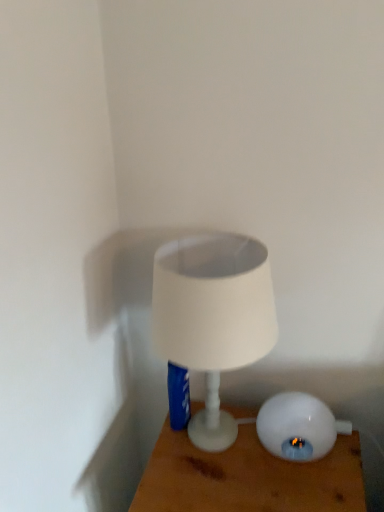
Find the location of `white matte lampshade at center, acting as the first lamp starting from the left`. white matte lampshade at center, acting as the first lamp starting from the left is located at coordinates (213, 317).

The height and width of the screenshot is (512, 384). What do you see at coordinates (248, 477) in the screenshot? I see `white glossy lamp at center` at bounding box center [248, 477].

Identify the location of white glossy lamp at lower right, the first lamp in the right-to-left sequence. (298, 426).

Between white glossy lamp at lower right, the second lamp from the left, and white matte lampshade at center, acting as the first lamp starting from the left, which one has more height?

Standing taller between the two is white matte lampshade at center, acting as the first lamp starting from the left.

Is point (276, 395) in front of point (154, 264)?

That is False.

Considering the relative sizes of white glossy lamp at lower right, the first lamp in the right-to-left sequence, and white matte lampshade at center, the 2th lamp when ordered from right to left, in the image provided, is white glossy lamp at lower right, the first lamp in the right-to-left sequence, thinner than white matte lampshade at center, the 2th lamp when ordered from right to left,?

Correct, the width of white glossy lamp at lower right, the first lamp in the right-to-left sequence, is less than that of white matte lampshade at center, the 2th lamp when ordered from right to left.

Consider the image. Is white glossy lamp at lower right, the second lamp from the left, directly adjacent to white matte lampshade at center, acting as the first lamp starting from the left?

No, white glossy lamp at lower right, the second lamp from the left, is not with white matte lampshade at center, acting as the first lamp starting from the left.

From the image's perspective, is white matte lampshade at center, the 2th lamp when ordered from right to left, positioned above or below white glossy lamp at center?

From the image's perspective, white matte lampshade at center, the 2th lamp when ordered from right to left, appears above white glossy lamp at center.

Considering the relative positions of white matte lampshade at center, the 2th lamp when ordered from right to left, and white glossy lamp at center in the image provided, is white matte lampshade at center, the 2th lamp when ordered from right to left, behind white glossy lamp at center?

No, it is in front of white glossy lamp at center.

Between white matte lampshade at center, the 2th lamp when ordered from right to left, and white glossy lamp at center, which one has smaller width?

white matte lampshade at center, the 2th lamp when ordered from right to left, is thinner.

Which of these two, white matte lampshade at center, the 2th lamp when ordered from right to left, or white glossy lamp at center, is smaller?

With smaller size is white matte lampshade at center, the 2th lamp when ordered from right to left.

This screenshot has height=512, width=384. Identify the location of lamp that is on the right side of white glossy lamp at center. (298, 426).

Is white glossy lamp at lower right, the first lamp in the right-to-left sequence, with white glossy lamp at center?

No.

Could you measure the distance between white glossy lamp at lower right, the second lamp from the left, and white glossy lamp at center?

white glossy lamp at lower right, the second lamp from the left, and white glossy lamp at center are 11.30 centimeters apart.

How different are the orientations of white matte lampshade at center, the 2th lamp when ordered from right to left, and white glossy lamp at lower right, the first lamp in the right-to-left sequence, in degrees?

white matte lampshade at center, the 2th lamp when ordered from right to left, and white glossy lamp at lower right, the first lamp in the right-to-left sequence, are facing 1.5 degrees away from each other.

Which of these two, white matte lampshade at center, the 2th lamp when ordered from right to left, or white glossy lamp at lower right, the first lamp in the right-to-left sequence, stands shorter?

Standing shorter between the two is white glossy lamp at lower right, the first lamp in the right-to-left sequence.

Is white matte lampshade at center, acting as the first lamp starting from the left, oriented towards white glossy lamp at lower right, the second lamp from the left?

No, white matte lampshade at center, acting as the first lamp starting from the left, does not turn towards white glossy lamp at lower right, the second lamp from the left.

Locate an element on the screen. The image size is (384, 512). lamp above the white glossy lamp at lower right, the first lamp in the right-to-left sequence (from the image's perspective) is located at coordinates (213, 317).

Is white glossy lamp at center positioned far away from white glossy lamp at lower right, the first lamp in the right-to-left sequence?

They are positioned close to each other.

From a real-world perspective, is white glossy lamp at center physically below white glossy lamp at lower right, the second lamp from the left?

Yes, from a real-world perspective, white glossy lamp at center is under white glossy lamp at lower right, the second lamp from the left.

Where is `furniture that is on the left side of white glossy lamp at lower right, the second lamp from the left`? The width and height of the screenshot is (384, 512). furniture that is on the left side of white glossy lamp at lower right, the second lamp from the left is located at coordinates (248, 477).

How different are the orientations of white glossy lamp at center and white glossy lamp at lower right, the second lamp from the left, in degrees?

There is a 1.65-degree angle between the facing directions of white glossy lamp at center and white glossy lamp at lower right, the second lamp from the left.

Does white glossy lamp at center turn towards white matte lampshade at center, the 2th lamp when ordered from right to left?

No, white glossy lamp at center does not turn towards white matte lampshade at center, the 2th lamp when ordered from right to left.

Based on their positions, is white glossy lamp at center located to the left or right of white matte lampshade at center, acting as the first lamp starting from the left?

white glossy lamp at center is positioned on white matte lampshade at center, acting as the first lamp starting from the left,'s right side.

From a real-world perspective, which object stands above the other?

In real-world perspective, white matte lampshade at center, acting as the first lamp starting from the left, is above.

This screenshot has height=512, width=384. Find the location of `lamp on the left of white glossy lamp at lower right, the first lamp in the right-to-left sequence`. lamp on the left of white glossy lamp at lower right, the first lamp in the right-to-left sequence is located at coordinates (213, 317).

Where is `lamp that is the 2nd object above the white glossy lamp at center (from a real-world perspective)`? Image resolution: width=384 pixels, height=512 pixels. lamp that is the 2nd object above the white glossy lamp at center (from a real-world perspective) is located at coordinates (213, 317).

Considering their positions, is white glossy lamp at center positioned further to white glossy lamp at lower right, the second lamp from the left, than white matte lampshade at center, acting as the first lamp starting from the left?

Based on the image, white matte lampshade at center, acting as the first lamp starting from the left, appears to be further to white glossy lamp at lower right, the second lamp from the left.

Estimate the real-world distances between objects in this image. Which object is closer to white glossy lamp at center, white glossy lamp at lower right, the second lamp from the left, or white matte lampshade at center, the 2th lamp when ordered from right to left?

white glossy lamp at lower right, the second lamp from the left, lies closer to white glossy lamp at center than the other object.

Consider the image. From the image, which object appears to be nearer to white glossy lamp at lower right, the second lamp from the left, white matte lampshade at center, the 2th lamp when ordered from right to left, or white glossy lamp at center?

Among the two, white glossy lamp at center is located nearer to white glossy lamp at lower right, the second lamp from the left.

From the image, which object appears to be farther from white matte lampshade at center, the 2th lamp when ordered from right to left, white glossy lamp at center or white glossy lamp at lower right, the second lamp from the left?

white glossy lamp at lower right, the second lamp from the left, is further to white matte lampshade at center, the 2th lamp when ordered from right to left.

Considering their positions, is white matte lampshade at center, acting as the first lamp starting from the left, positioned closer to white glossy lamp at center than white glossy lamp at lower right, the second lamp from the left?

white glossy lamp at lower right, the second lamp from the left, is positioned closer to the anchor white glossy lamp at center.

From the image, which object appears to be farther from white matte lampshade at center, acting as the first lamp starting from the left, white glossy lamp at lower right, the first lamp in the right-to-left sequence, or white glossy lamp at center?

Among the two, white glossy lamp at lower right, the first lamp in the right-to-left sequence, is located further to white matte lampshade at center, acting as the first lamp starting from the left.

Locate an element on the screen. lamp between white matte lampshade at center, acting as the first lamp starting from the left, and white glossy lamp at center in the up-down direction is located at coordinates (298, 426).